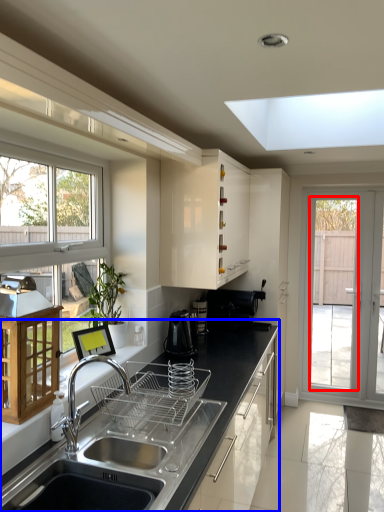
Question: Among these objects, which one is nearest to the camera, screen door (highlighted by a red box) or countertop (highlighted by a blue box)?

Choices:
 (A) screen door
 (B) countertop

Answer: (B)